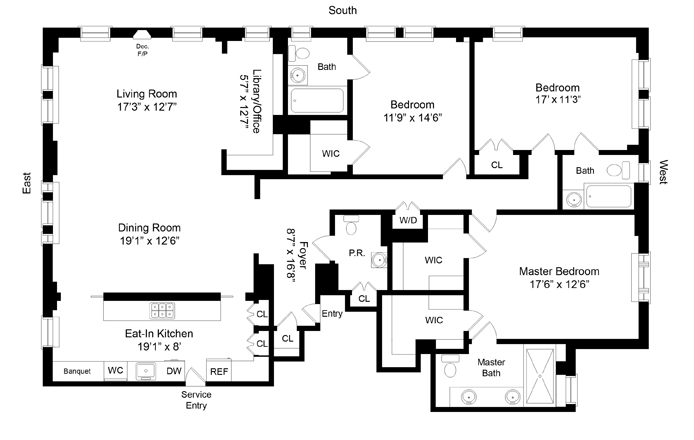
Image resolution: width=694 pixels, height=440 pixels. What are the coordinates of `washer dryer` in the screenshot? It's located at (407, 219).